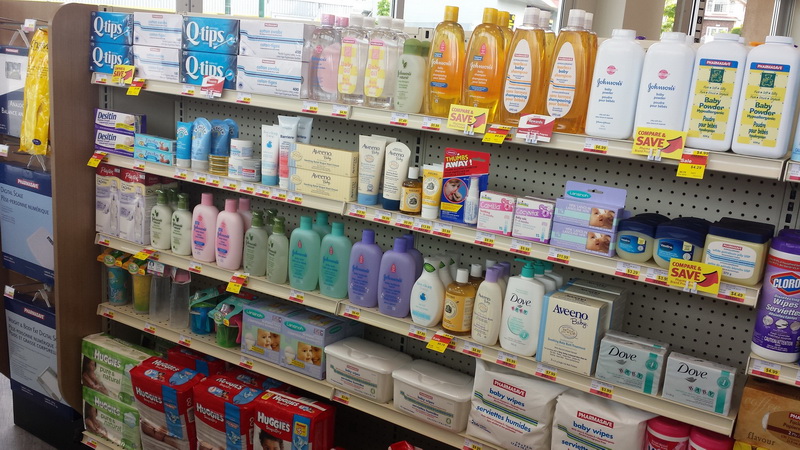
At what (x,y) coordinates should I click in order to perform the action: click on shelf. Please return your answer as a coordinate pair (x, y). The width and height of the screenshot is (800, 450). Looking at the image, I should click on (164, 337), (266, 288), (321, 208), (370, 117).